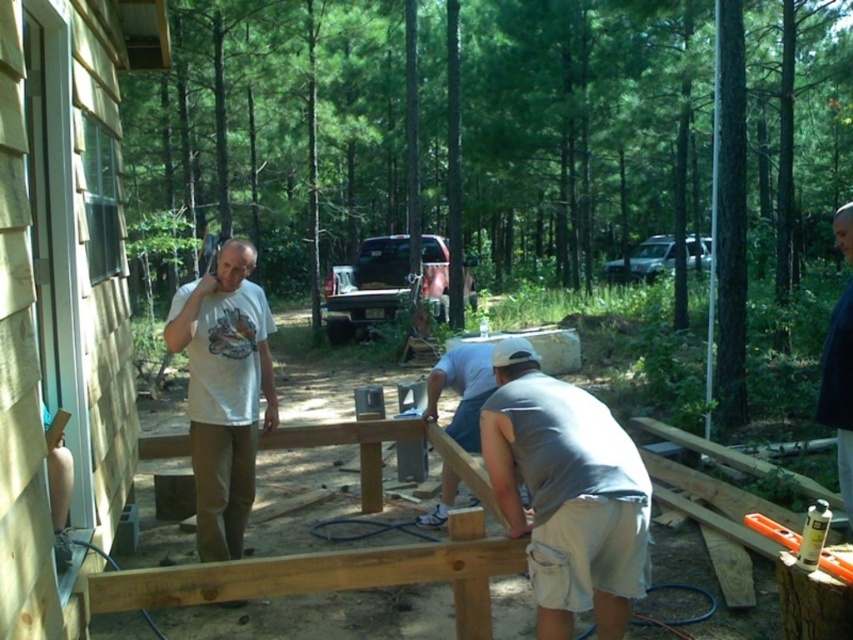
In the scene shown: You are a construction worker standing at the camera position. You need to hand a tool to the gray cotton shirt at center. Is the distance within your comfortable reaching range?

The distance between you and the gray cotton shirt at center is 2.98 meters, which is beyond a typical comfortable reaching range. You should move closer or ask them to come nearer.